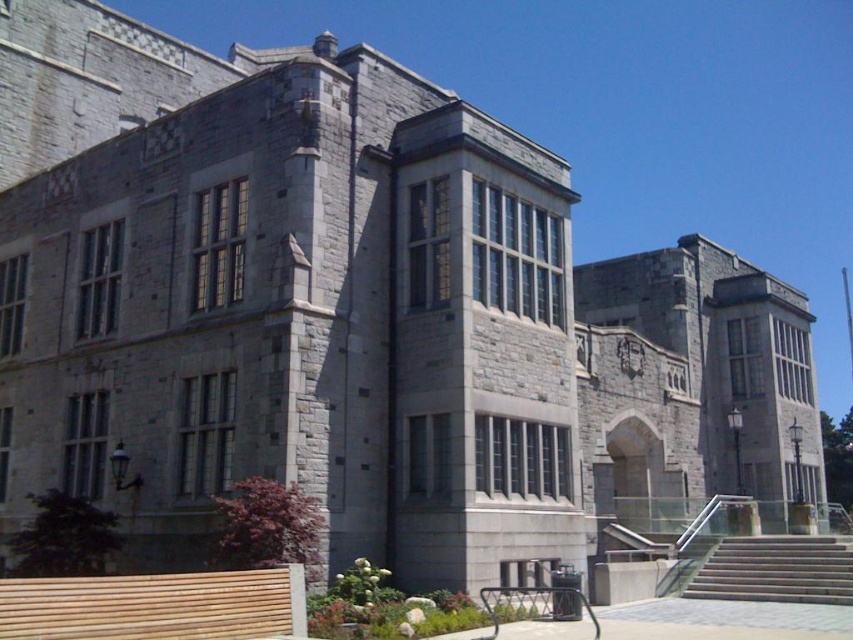
You are a tourist standing at the base of the building and want to take a photo of the entrance. You have a light brown wooden park bench at lower left and a concrete stairs at lower right in your view. Which object should you move closer to in order to frame the entrance between them?

To frame the entrance between the light brown wooden park bench at lower left and the concrete stairs at lower right, you should move closer to the light brown wooden park bench at lower left since it is in front of the concrete stairs at lower right, allowing the entrance to be centered between them.

You are standing at the base of the steps leading to the historic stone building. You want to take a photo of a specific point located at coordinates point (88, 589). The camera you are using has a maximum focus range of 30 meters. Will the camera be able to focus on that point?

The distance of point (88, 589) from camera is 30.64 meters, so the camera cannot focus on that point because it exceeds the maximum focus range of 30 meters.

You are a visitor standing at the base of the building and want to sit down. Which object, the light brown wooden park bench at lower left or the concrete stairs at lower right, would provide more seating space?

The light brown wooden park bench at lower left is larger in size than the concrete stairs at lower right, so it provides more seating space.